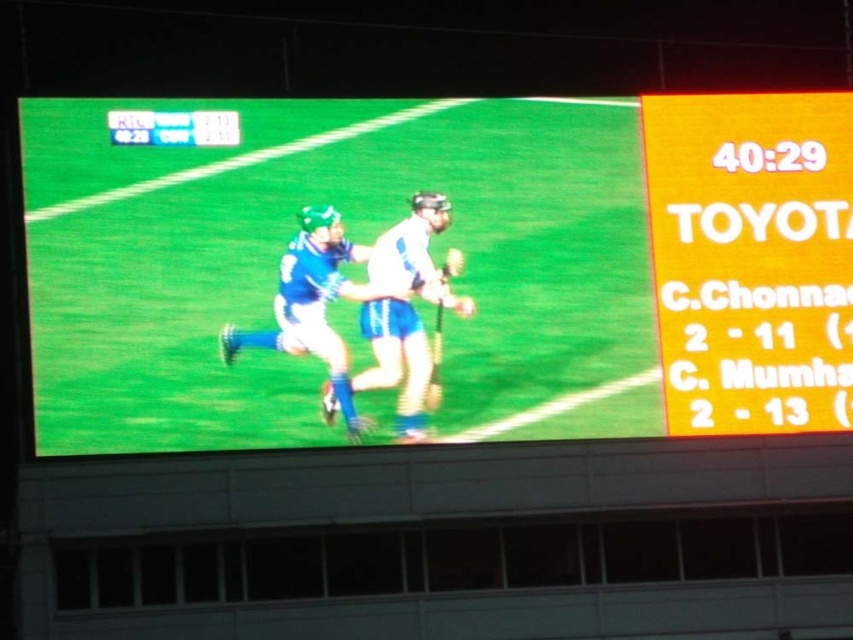
Question: Where is matte blue shorts at center located in relation to blue fabric jersey at center in the image?

Choices:
 (A) below
 (B) above

Answer: (B)

Question: Which point is closer to the camera taking this photo?

Choices:
 (A) (289, 291)
 (B) (399, 336)

Answer: (A)

Question: Is matte blue shorts at center above white matte jersey at center?

Choices:
 (A) yes
 (B) no

Answer: (A)

Question: Considering the real-world distances, which object is closest to the blue fabric jersey at center?

Choices:
 (A) matte blue shorts at center
 (B) white matte jersey at center

Answer: (B)

Question: Is matte blue shorts at center wider than blue fabric jersey at center?

Choices:
 (A) no
 (B) yes

Answer: (B)

Question: Which of these objects is positioned closest to the white matte jersey at center?

Choices:
 (A) matte blue shorts at center
 (B) blue fabric jersey at center

Answer: (B)